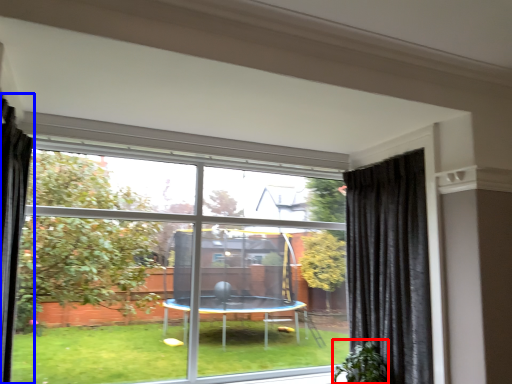
Question: Which object appears closest to the camera in this image, plant (highlighted by a red box) or curtain (highlighted by a blue box)?

Choices:
 (A) plant
 (B) curtain

Answer: (B)